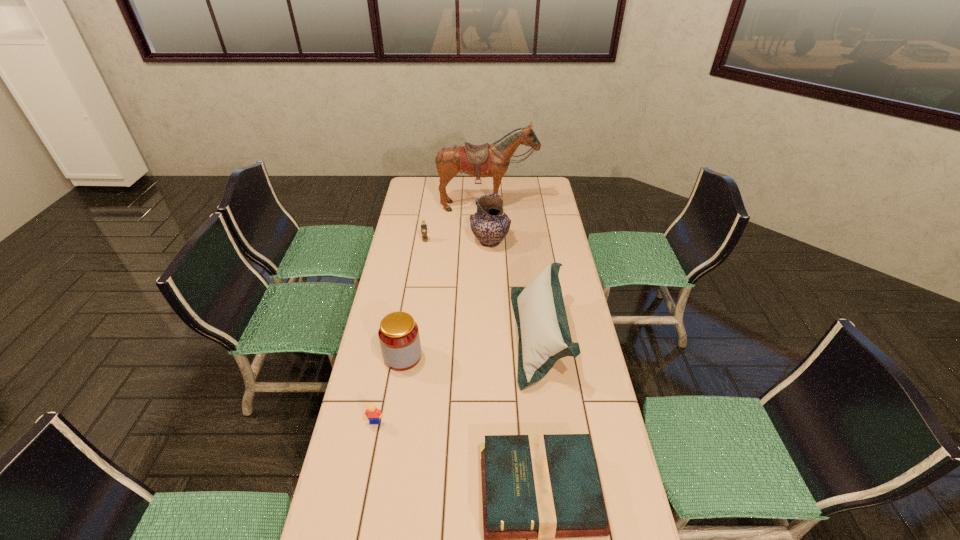
Where is `object that stands as the fifth closest to the cushion`? object that stands as the fifth closest to the cushion is located at coordinates (423, 225).

The image size is (960, 540). In order to click on vacant area that satisfies the following two spatial constraints: 1. on the front label of the second tallest object; 2. on the right side of the soda in this screenshot , I will do `click(425, 242)`.

Find the location of a particular element. This screenshot has width=960, height=540. blank area in the image that satisfies the following two spatial constraints: 1. on the surface of the cushion; 2. on the face of the sixth farthest object is located at coordinates (551, 422).